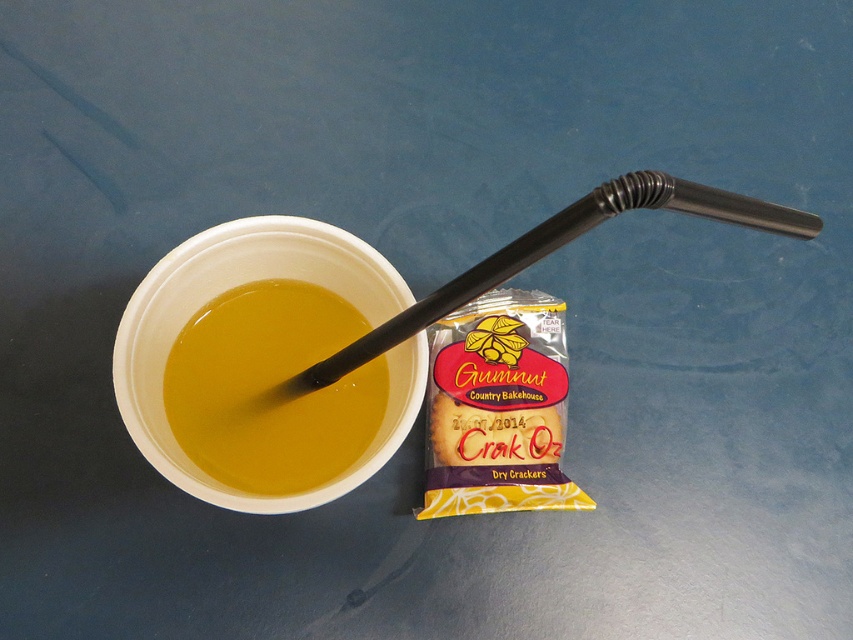
Question: Does yellow matte liquid at center have a larger size compared to black plastic straw at upper center?

Choices:
 (A) no
 (B) yes

Answer: (A)

Question: Which point is closer to the camera taking this photo?

Choices:
 (A) (451, 284)
 (B) (323, 451)

Answer: (A)

Question: Where is yellow matte liquid at center located in relation to black plastic straw at upper center in the image?

Choices:
 (A) below
 (B) above

Answer: (A)

Question: Is yellow matte liquid at center above black plastic straw at upper center?

Choices:
 (A) no
 (B) yes

Answer: (A)